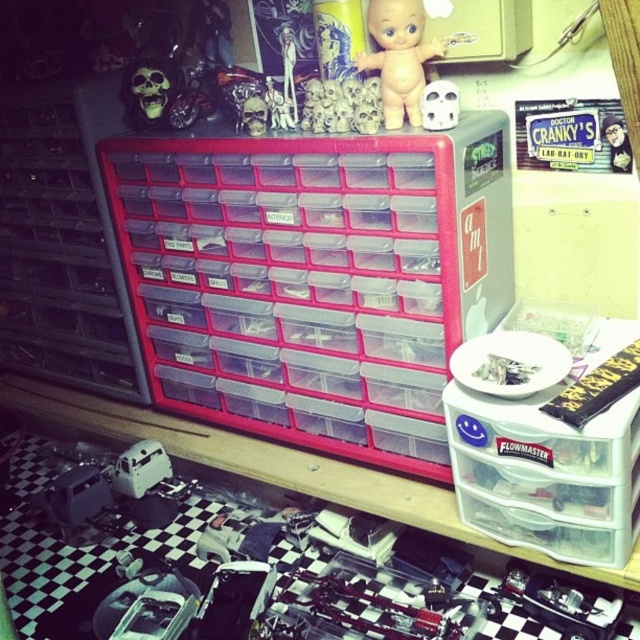
What is the spatial relationship between the bare skin doll at upper center and the metallic silver toy at upper right in the image?

The bare skin doll at upper center is positioned in front of the metallic silver toy at upper right, meaning the toy is partially obscured or located behind the doll from the viewer perspective.

You are a hobbyist trying to reach the metallic silver toy at upper right without touching the matte plastic skull at center. Can you do it?

The matte plastic skull at center is closer to the viewer than the metallic silver toy at upper right, so you would need to move around or lift the skull to access the toy without touching it.

Based on the photo, you are a new employee in a workshop and need to locate two specific points marked in the image. The first point is labeled as point (394, 81) and the second is point (612, 141). Your supervisor asks which point is closer to you. Which one should you tell them?

Point (394, 81) is closer to the viewer than point (612, 141).